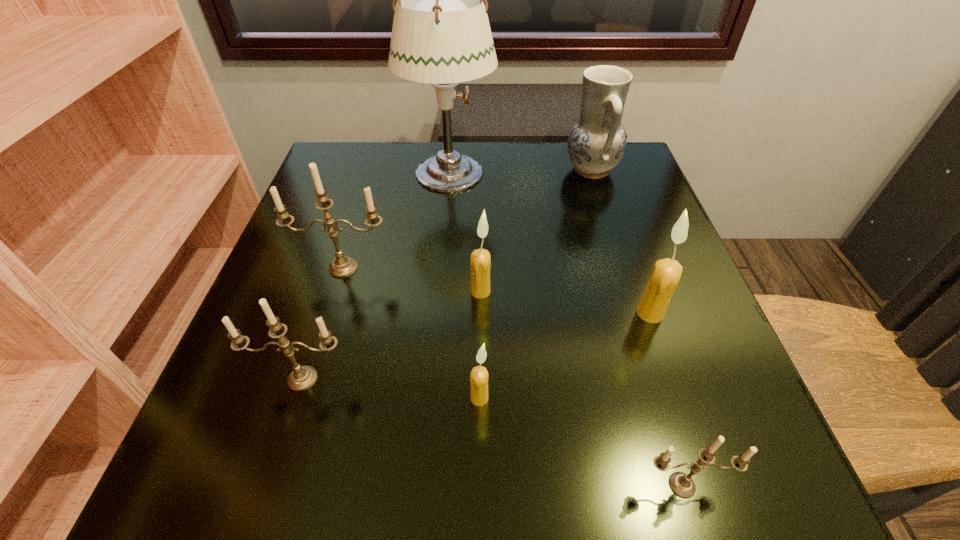
The image size is (960, 540). I want to click on vacant area that satisfies the following two spatial constraints: 1. on the lampshade of the tallest object; 2. on the right side of the smallest cream candle, so click(430, 398).

The height and width of the screenshot is (540, 960). Find the location of `free space that satisfies the following two spatial constraints: 1. on the lampshade of the lampshade; 2. on the back side of the smallest metallic candle`. free space that satisfies the following two spatial constraints: 1. on the lampshade of the lampshade; 2. on the back side of the smallest metallic candle is located at coordinates (422, 485).

You are a GUI agent. You are given a task and a screenshot of the screen. Output one action in this format:
    pyautogui.click(x=<x>, y=<y>)
    Task: Click on the vacant space that satisfies the following two spatial constraints: 1. on the lampshade of the nearest cream candle; 2. on the right side of the lampshade
    Image resolution: width=960 pixels, height=540 pixels.
    Given the screenshot: What is the action you would take?
    pyautogui.click(x=430, y=398)

Identify the location of free point that satisfies the following two spatial constraints: 1. on the lampshade of the tallest object; 2. on the right side of the nearest candle. (422, 485).